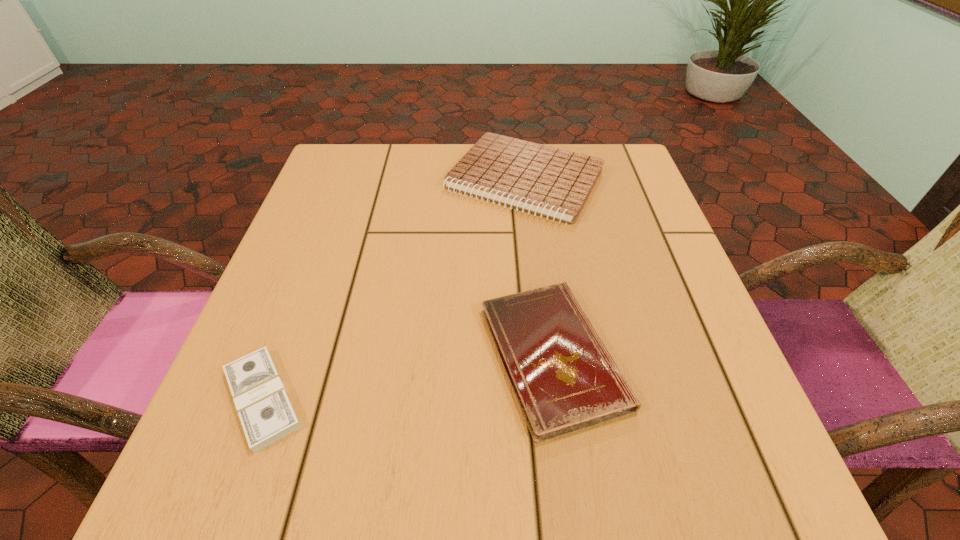
Identify the location of vacant space in between the farthest object and the leftmost object. Image resolution: width=960 pixels, height=540 pixels. (394, 289).

At what (x,y) coordinates should I click in order to perform the action: click on free spot between the leftmost object and the taller notebook. Please return your answer as a coordinate pair (x, y). The image size is (960, 540). Looking at the image, I should click on (394, 289).

Image resolution: width=960 pixels, height=540 pixels. I want to click on free space between the dollar and the tallest object, so click(394, 289).

Find the location of a particular element. The height and width of the screenshot is (540, 960). object that is the nearest to the dollar is located at coordinates (564, 378).

Where is `object identified as the second closest to the leftmost object`? The height and width of the screenshot is (540, 960). object identified as the second closest to the leftmost object is located at coordinates point(553,182).

The height and width of the screenshot is (540, 960). In order to click on free point that satisfies the following two spatial constraints: 1. on the back side of the leftmost object; 2. on the right side of the farther notebook in this screenshot , I will do `click(345, 180)`.

Where is `free space that satisfies the following two spatial constraints: 1. on the back side of the dollar; 2. on the left side of the tallest object`? free space that satisfies the following two spatial constraints: 1. on the back side of the dollar; 2. on the left side of the tallest object is located at coordinates (345, 180).

Locate an element on the screen. The image size is (960, 540). blank area in the image that satisfies the following two spatial constraints: 1. on the back side of the dollar; 2. on the left side of the second tallest object is located at coordinates (278, 356).